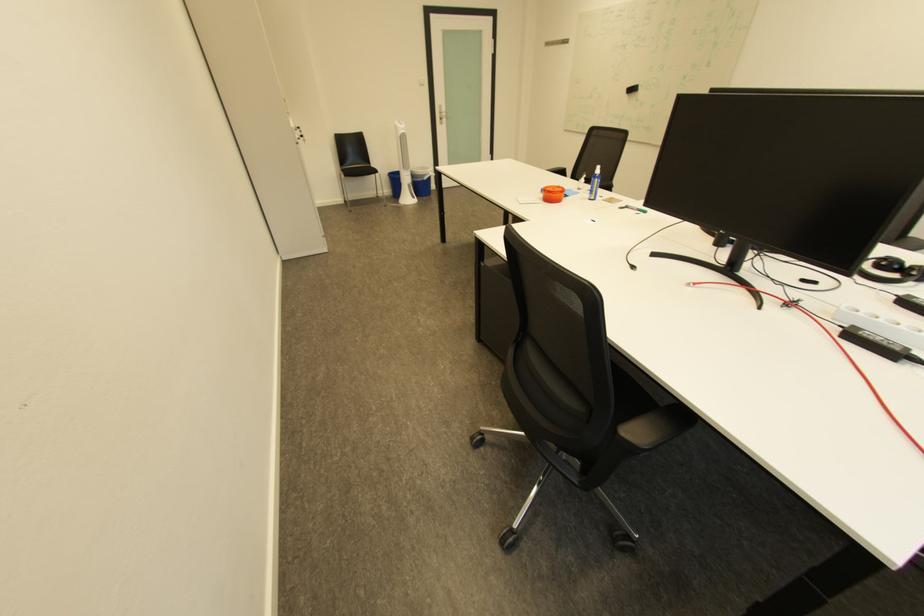
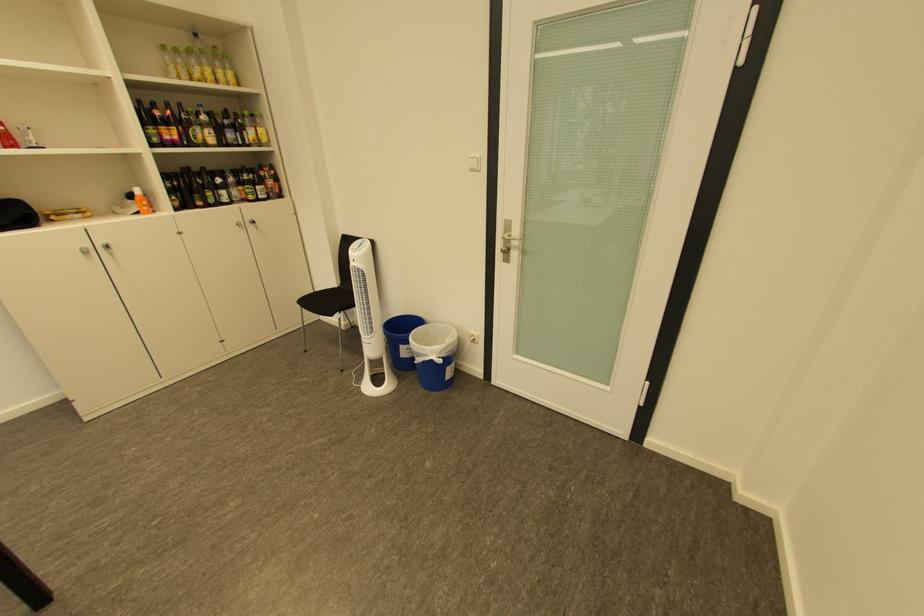
Find the pixel in the second image that matches (x=434, y=177) in the first image.

(429, 355)